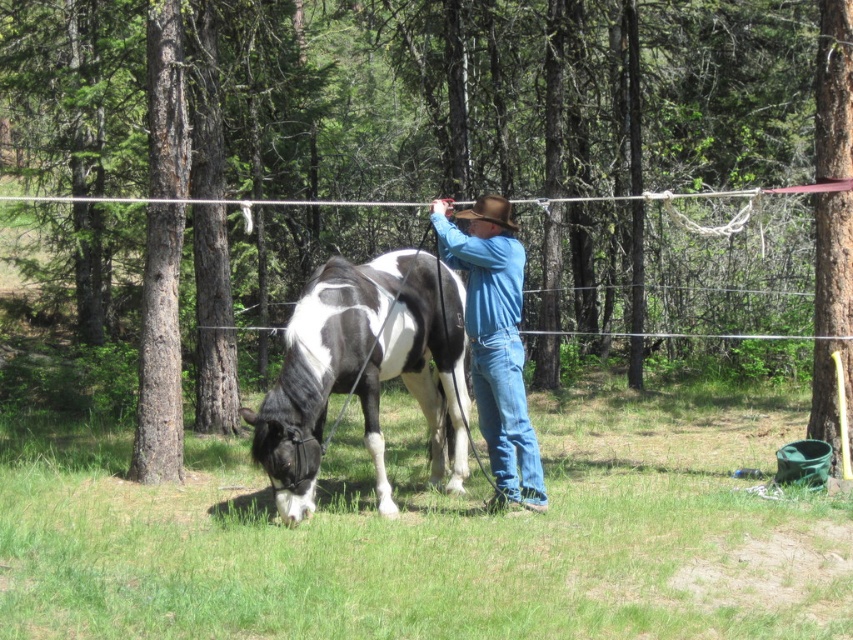
Question: Which point is farther to the camera?

Choices:
 (A) brown felt cowboy hat at center
 (B) green grass at lower center

Answer: (A)

Question: Can you confirm if brown rough bark tree at left is smaller than brown felt cowboy hat at center?

Choices:
 (A) no
 (B) yes

Answer: (A)

Question: Does black-and-white speckled horse at center have a greater width compared to blue denim jeans at center?

Choices:
 (A) yes
 (B) no

Answer: (A)

Question: Can you confirm if black-and-white speckled horse at center is positioned above brown felt cowboy hat at center?

Choices:
 (A) yes
 (B) no

Answer: (B)

Question: Among these points, which one is nearest to the camera?

Choices:
 (A) (152, 3)
 (B) (503, 349)
 (C) (717, 396)
 (D) (329, 285)

Answer: (B)

Question: Which point appears farthest from the camera in this image?

Choices:
 (A) (469, 216)
 (B) (488, 456)
 (C) (164, 340)

Answer: (B)